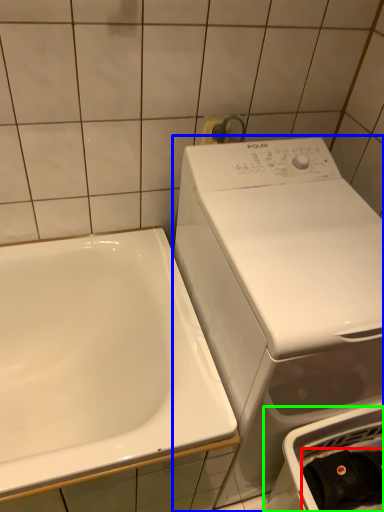
Question: Based on their relative distances, which object is nearer to clothing (highlighted by a red box)? Choose from washing machine (highlighted by a blue box) and dish washer (highlighted by a green box).

Choices:
 (A) washing machine
 (B) dish washer

Answer: (B)